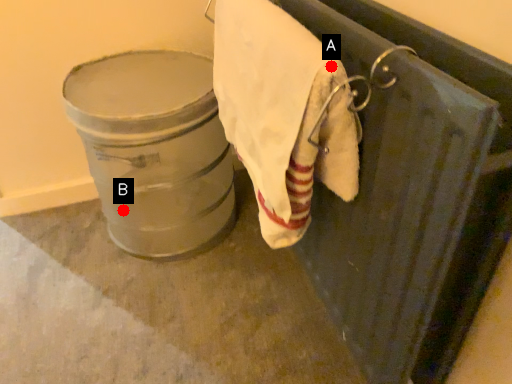
Question: Two points are circled on the image, labeled by A and B beside each circle. Which of the following is the closest to the observer?

Choices:
 (A) A is closer
 (B) B is closer

Answer: (A)